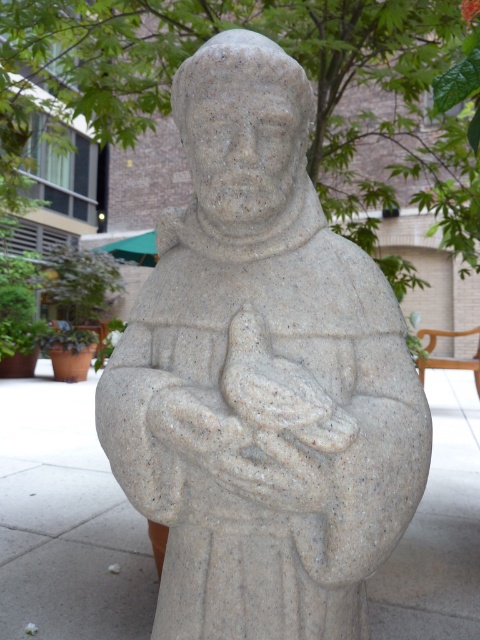
Locate an element on the screen. Image resolution: width=480 pixels, height=640 pixels. granite statue at center is located at coordinates (262, 376).

Who is shorter, granite statue at center or smooth stone statue at center?

Standing shorter between the two is smooth stone statue at center.

Who is more forward, (230, 305) or (421, 508)?

Point (230, 305) is in front.

Locate an element on the screen. granite statue at center is located at coordinates (262, 376).